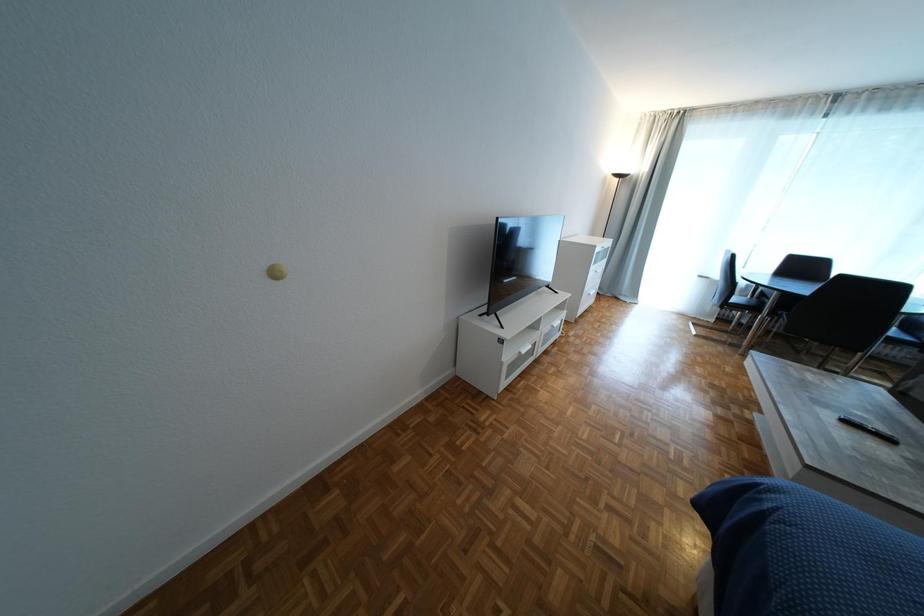
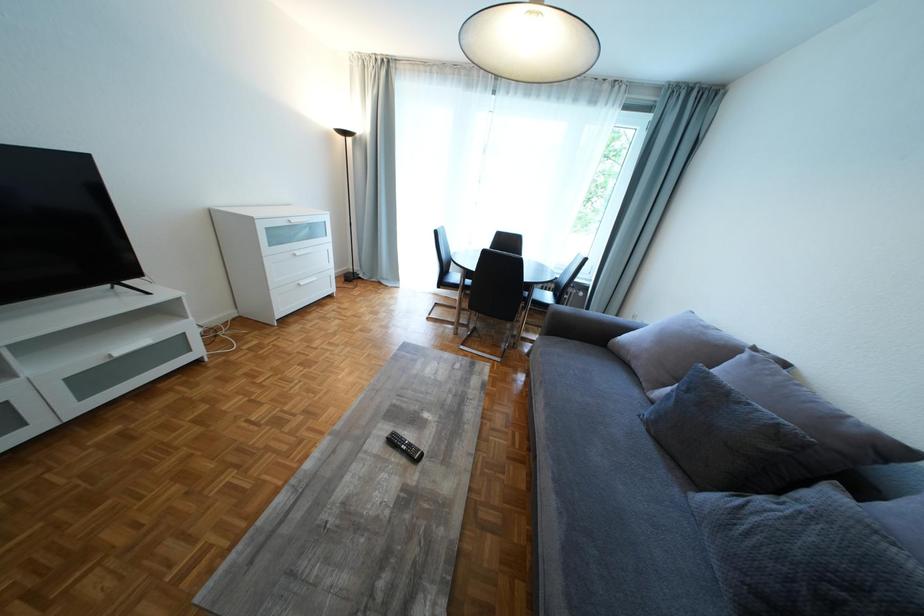
Question: The images are taken continuously from a first-person perspective. In which direction are you moving?

Choices:
 (A) Left
 (B) Right
 (C) Forward
 (D) Backward

Answer: (B)